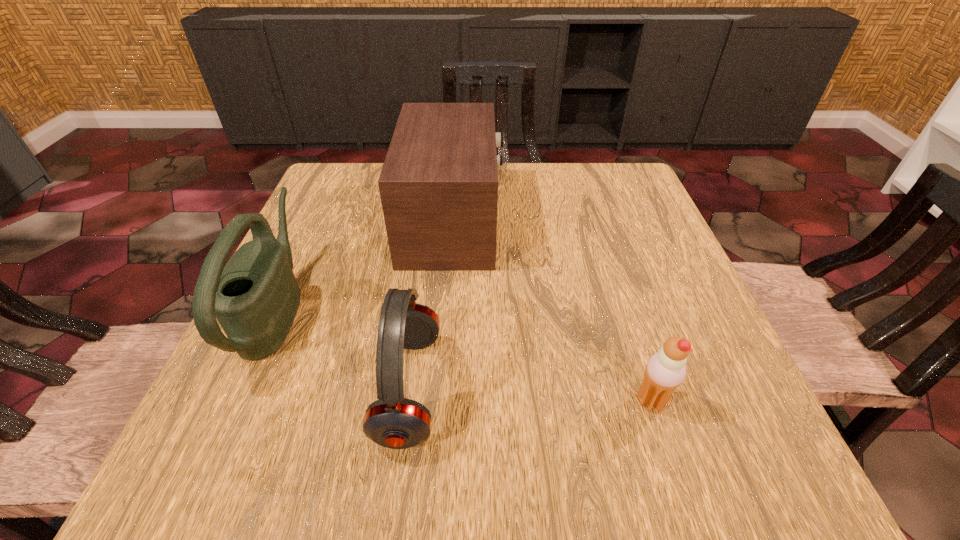
Find the location of a particular element. This screenshot has width=960, height=540. object that is at the far edge is located at coordinates (438, 185).

You are a GUI agent. You are given a task and a screenshot of the screen. Output one action in this format:
    pyautogui.click(x=<x>, y=<y>)
    Task: Click on the object located at the near edge
    The height and width of the screenshot is (540, 960).
    Given the screenshot: What is the action you would take?
    pyautogui.click(x=392, y=421)

Locate an element on the screen. The height and width of the screenshot is (540, 960). object positioned at the left edge is located at coordinates (255, 297).

This screenshot has width=960, height=540. I want to click on object positioned at the right edge, so click(x=664, y=372).

Where is `free space at the far edge of the desktop`? The height and width of the screenshot is (540, 960). free space at the far edge of the desktop is located at coordinates (501, 193).

The height and width of the screenshot is (540, 960). In order to click on free space at the near edge in this screenshot , I will do `click(443, 441)`.

In the image, there is a desktop. What are the coordinates of `vacant space at the left edge` in the screenshot? It's located at [x=336, y=303].

Where is `vacant space at the right edge of the desktop`? vacant space at the right edge of the desktop is located at coordinates (714, 409).

This screenshot has height=540, width=960. Identify the location of free spot at the far left corner of the desktop. (338, 173).

This screenshot has width=960, height=540. Find the location of `vacant space at the far right corner of the desktop`. vacant space at the far right corner of the desktop is located at coordinates (615, 178).